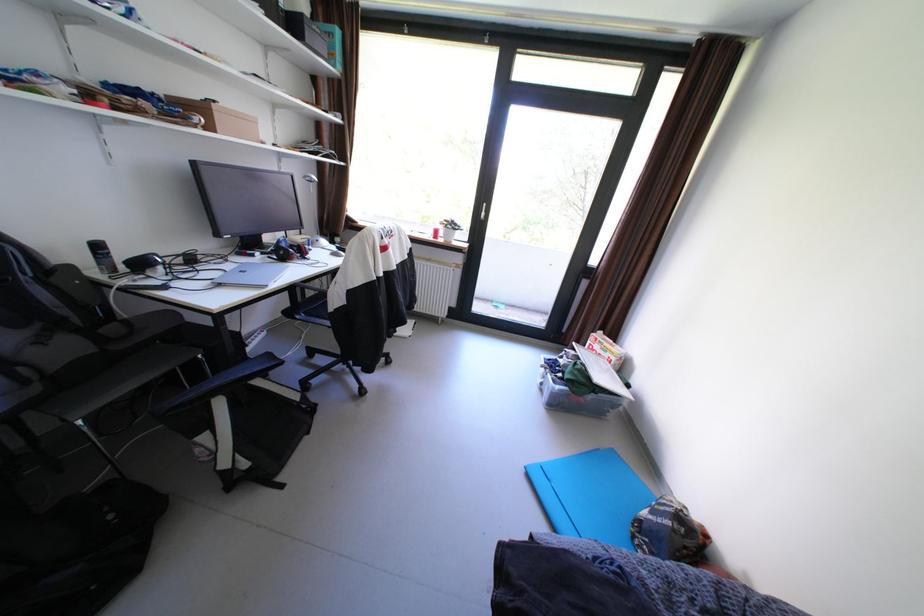
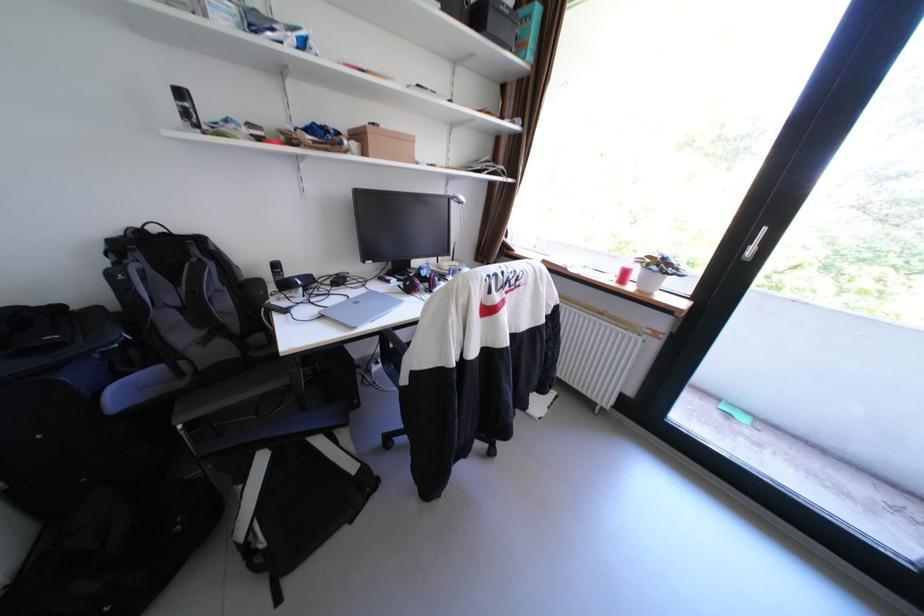
Question: The camera is either moving clockwise (left) or counter-clockwise (right) around the object. The first image is from the beginning of the video and the second image is from the end. Is the camera moving left or right when shooting the video?

Choices:
 (A) Left
 (B) Right

Answer: (B)